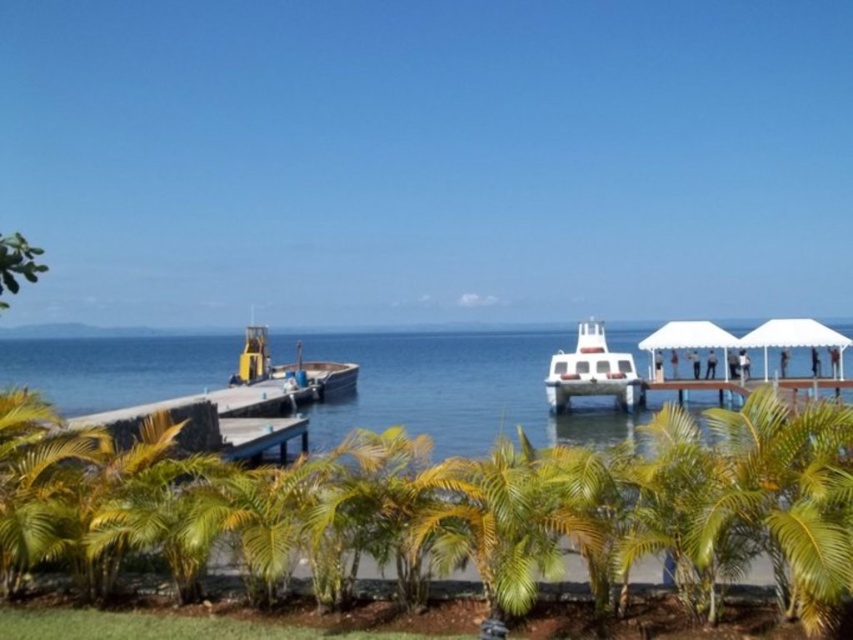
Question: Which is farther from the yellow-green leafy palm tree at center?

Choices:
 (A) yellow matte boat at lower left
 (B) white wooden dock at lower right
 (C) white glossy boat at center

Answer: (A)

Question: Which object is farther from the camera taking this photo?

Choices:
 (A) yellow matte boat at lower left
 (B) smooth concrete dock at left
 (C) clear blue water at center
 (D) yellow-green leafy palm tree at center

Answer: (A)

Question: Does white glossy boat at center appear on the right side of white wooden dock at lower right?

Choices:
 (A) yes
 (B) no

Answer: (B)

Question: Can you confirm if yellow matte boat at lower left is positioned below white wooden dock at lower right?

Choices:
 (A) no
 (B) yes

Answer: (B)

Question: Among these points, which one is farthest from the camera?

Choices:
 (A) (258, 403)
 (B) (717, 388)

Answer: (B)

Question: Can you confirm if smooth concrete dock at left is positioned below white glossy boat at center?

Choices:
 (A) yes
 (B) no

Answer: (A)